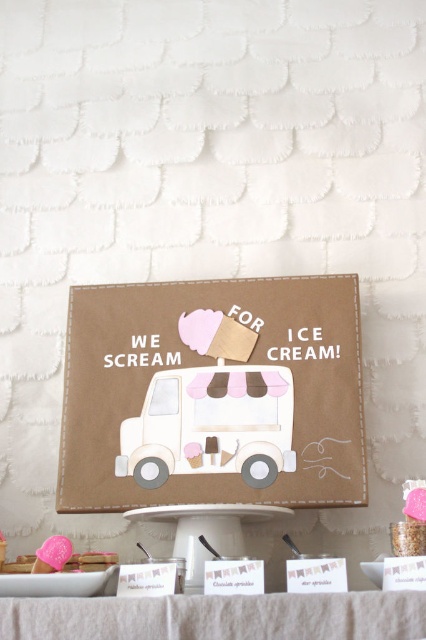
Question: Does brown paper ice cream truck at center appear on the left side of white linen tablecloth at lower center?

Choices:
 (A) yes
 (B) no

Answer: (A)

Question: Which point appears farthest from the camera in this image?

Choices:
 (A) (66, 570)
 (B) (37, 636)
 (C) (124, 467)

Answer: (C)

Question: Does brown paper ice cream truck at center have a smaller size compared to white cardboard ice cream truck at center?

Choices:
 (A) yes
 (B) no

Answer: (B)

Question: Which object appears farthest from the camera in this image?

Choices:
 (A) pink frosted cookie at center
 (B) brown paper ice cream truck at center

Answer: (B)

Question: Does brown paper ice cream truck at center have a lesser width compared to white cardboard ice cream truck at center?

Choices:
 (A) yes
 (B) no

Answer: (B)

Question: Which point appears closest to the camera in this image?

Choices:
 (A) (222, 314)
 (B) (60, 602)

Answer: (B)